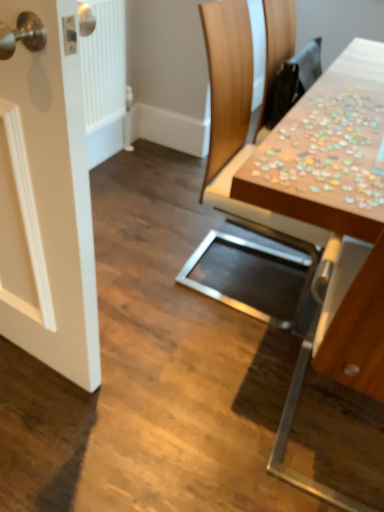
Identify the location of vacant point to the left of wooden puzzle pieces at upper right. The height and width of the screenshot is (512, 384). (185, 208).